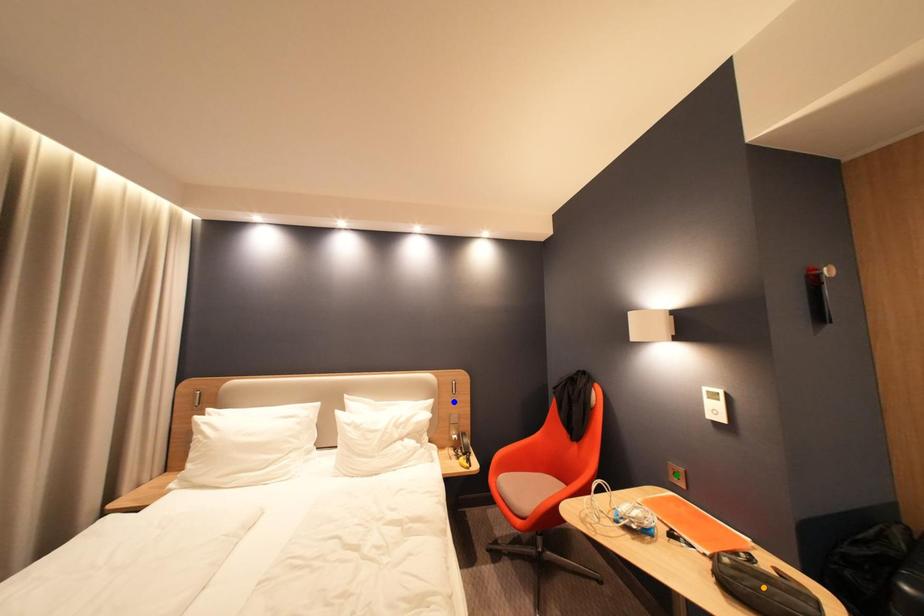
Order these from nearest to farthest:
A) orange point
B) green point
C) blue point

1. orange point
2. green point
3. blue point